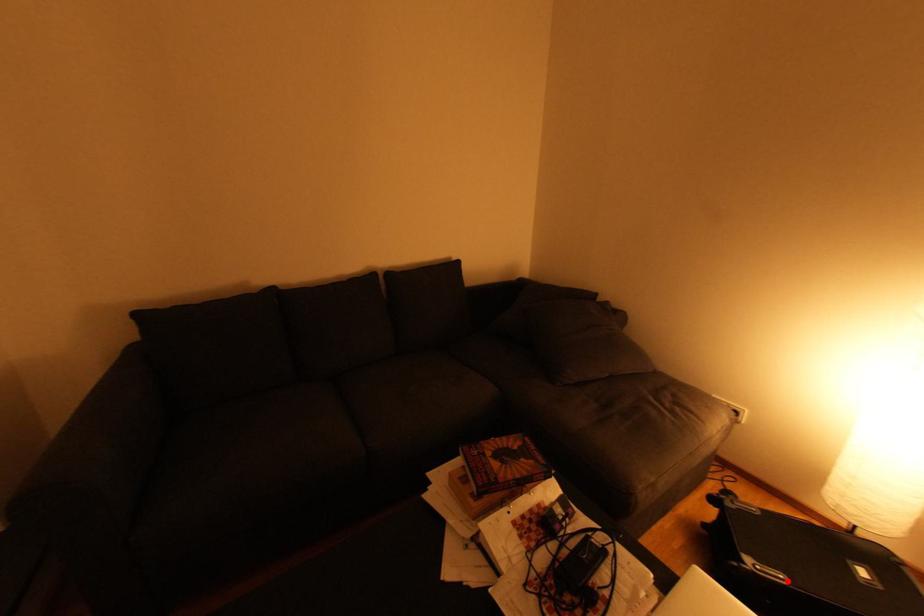
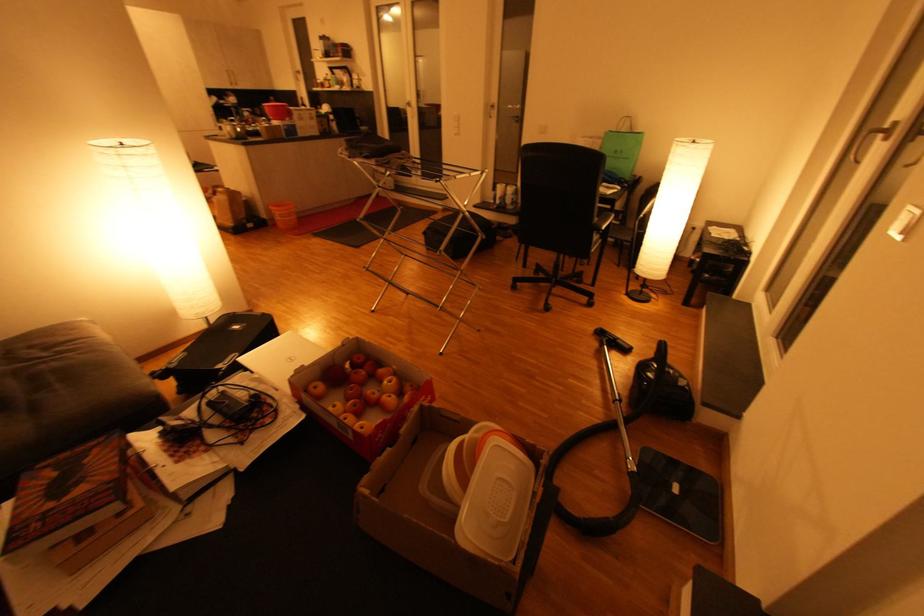
Question: I am providing you with two images of the same scene from different viewpoints. Image1 has a red point marked. In image2, the corresponding 3D location appears at what relative position? Reply with the corresponding letter.

Choices:
 (A) Closer
 (B) Farther

Answer: (B)